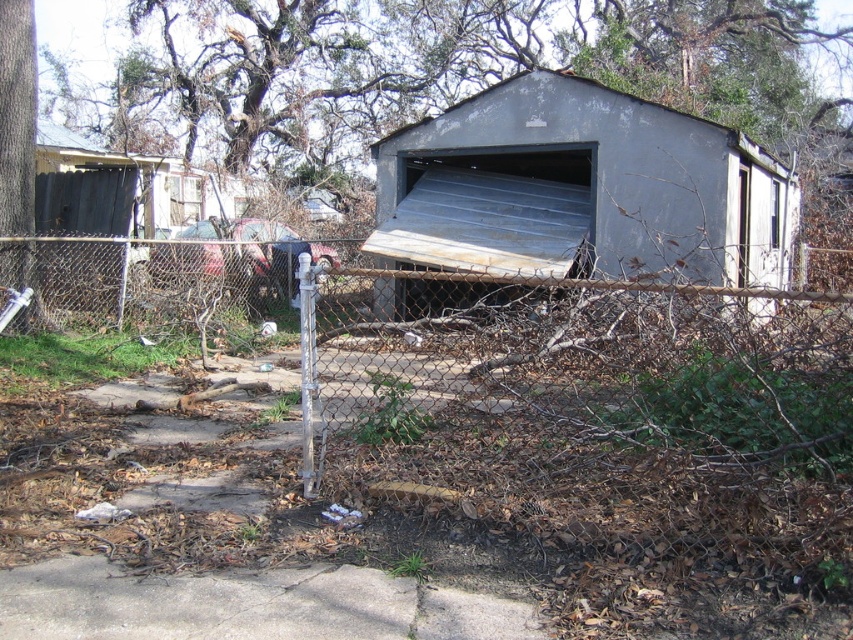
You are a maintenance worker standing in front of the rusty metal shed at center and the rusty metal garage door at center. Which structure is closer to you?

The rusty metal garage door at center is closer to you because it is in front of the rusty metal shed at center, which is further away.

You are a delivery person with a box that measures 30 inches in length. You need to deliver this box through the space between the rusty metal shed at center and the rusty metal garage door at center. Can the box fit through that space?

The distance between the rusty metal shed at center and the rusty metal garage door at center is 29.70 inches. Since the box is 30 inches long, it is slightly longer than the available space. Therefore, the box cannot fit through the space between them.